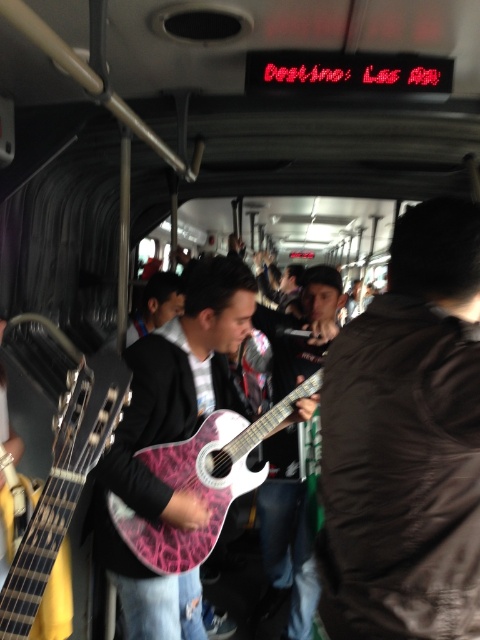
Question: Which object is positioned farthest from the black leather jacket at right?

Choices:
 (A) pink textured guitar at center
 (B) matte black guitar at center

Answer: (B)

Question: Which point is closer to the camera?

Choices:
 (A) matte black guitar at center
 (B) black leather jacket at right
 (C) pink textured guitar at center

Answer: (B)

Question: Is black leather jacket at right positioned in front of matte black guitar at center?

Choices:
 (A) no
 (B) yes

Answer: (B)

Question: Does black leather jacket at right have a lesser width compared to pink textured guitar at center?

Choices:
 (A) no
 (B) yes

Answer: (B)

Question: Can you confirm if pink textured guitar at center is smaller than matte black guitar at center?

Choices:
 (A) no
 (B) yes

Answer: (A)

Question: Which object is the closest to the matte black guitar at center?

Choices:
 (A) pink textured guitar at center
 (B) pink glossy guitar at center
 (C) black leather jacket at right

Answer: (A)